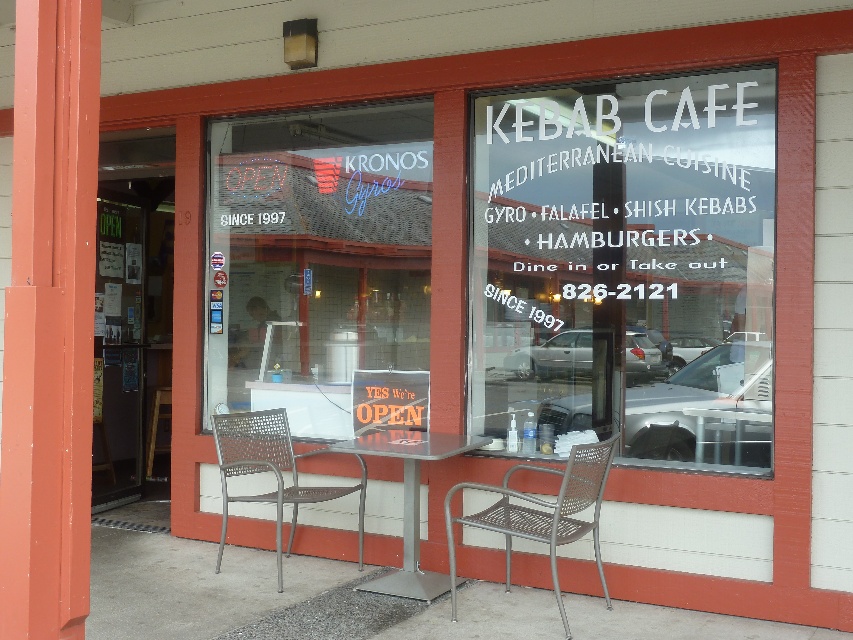
Question: Is transparent glass window at center positioned before transparent glass sign at center?

Choices:
 (A) yes
 (B) no

Answer: (A)

Question: Is transparent glass sign at center closer to camera compared to metallic mesh chair at lower center?

Choices:
 (A) no
 (B) yes

Answer: (A)

Question: Considering the real-world distances, which object is closest to the metallic mesh chair at center?

Choices:
 (A) metallic mesh chair at lower center
 (B) transparent glass sign at center
 (C) transparent glass window at center
 (D) metallic silver table at center

Answer: (D)

Question: Which point is closer to the camera?

Choices:
 (A) metallic silver table at center
 (B) metallic mesh chair at center

Answer: (A)

Question: Can you confirm if transparent glass window at center is bigger than metallic silver table at center?

Choices:
 (A) yes
 (B) no

Answer: (A)

Question: Which object appears farthest from the camera in this image?

Choices:
 (A) transparent glass window at center
 (B) transparent glass sign at center
 (C) metallic mesh chair at lower center
 (D) metallic mesh chair at center

Answer: (B)